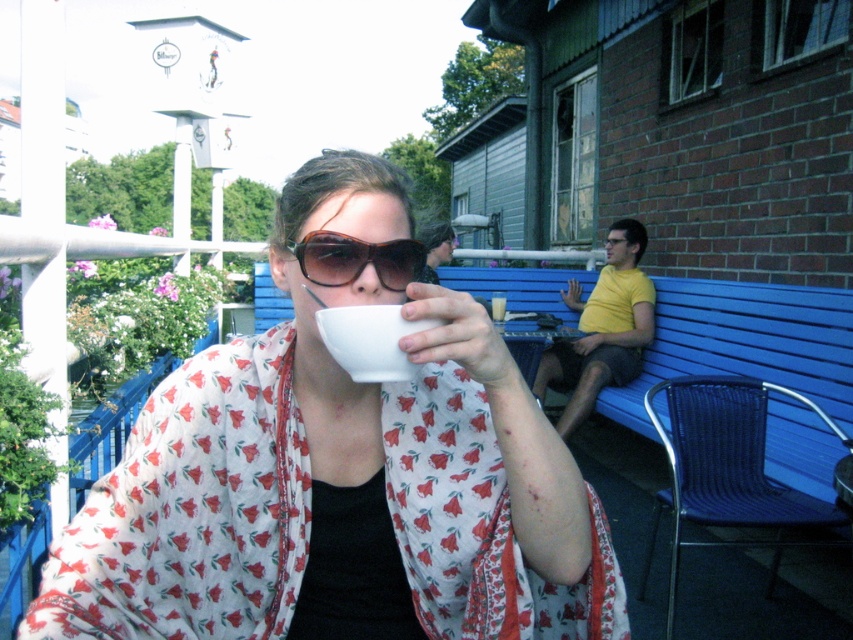
Question: Does white glossy mug at center appear under matte black sunglasses at center?

Choices:
 (A) no
 (B) yes

Answer: (B)

Question: Does white glossy mug at center appear on the left side of matte black sunglasses at center?

Choices:
 (A) no
 (B) yes

Answer: (B)

Question: Among these points, which one is farthest from the camera?

Choices:
 (A) (231, 448)
 (B) (361, 260)

Answer: (A)

Question: Can you confirm if white glossy mug at center is bigger than matte black sunglasses at center?

Choices:
 (A) yes
 (B) no

Answer: (A)

Question: Which point is farther from the camera taking this photo?

Choices:
 (A) (419, 264)
 (B) (483, 422)

Answer: (B)